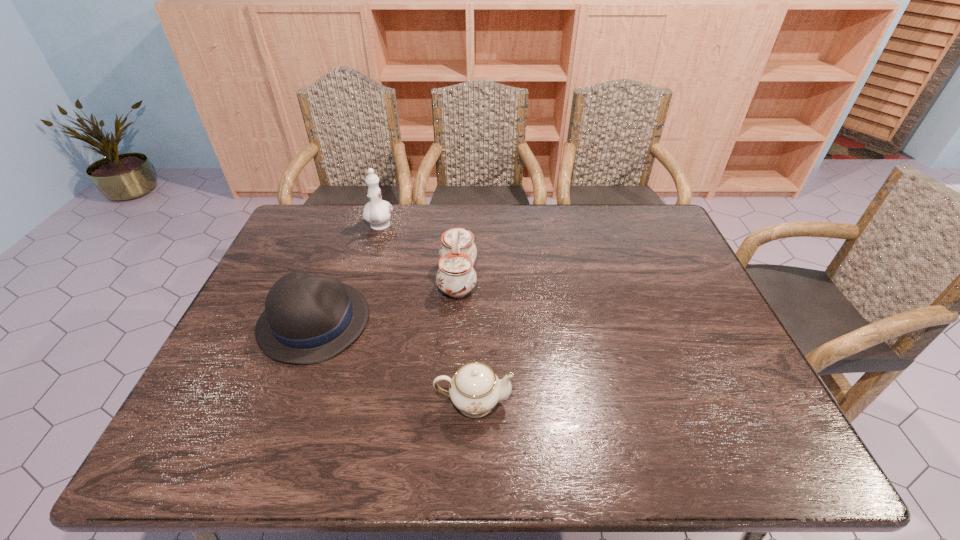
The width and height of the screenshot is (960, 540). I want to click on the tallest object, so click(377, 212).

Locate an element on the screen. the tallest chinaware is located at coordinates (377, 212).

Locate an element on the screen. Image resolution: width=960 pixels, height=540 pixels. the second nearest chinaware is located at coordinates (456, 277).

Locate an element on the screen. This screenshot has height=540, width=960. bowler hat is located at coordinates (308, 319).

The width and height of the screenshot is (960, 540). In order to click on the nearest chinaware in this screenshot , I will do `click(475, 389)`.

Locate an element on the screen. This screenshot has height=540, width=960. the shortest object is located at coordinates (475, 389).

You are a GUI agent. You are given a task and a screenshot of the screen. Output one action in this format:
    pyautogui.click(x=<x>, y=<y>)
    Task: Click on the free space located 0.270m at the spout of the tallest object
    The width and height of the screenshot is (960, 540).
    Given the screenshot: What is the action you would take?
    pyautogui.click(x=359, y=296)

The width and height of the screenshot is (960, 540). I want to click on free space located 0.240m by the handle of the second tallest chinaware, so click(x=558, y=279).

You are a GUI agent. You are given a task and a screenshot of the screen. Output one action in this format:
    pyautogui.click(x=<x>, y=<y>)
    Task: Click on the vacant region located on the front-facing side of the third tallest object
    The width and height of the screenshot is (960, 540).
    Given the screenshot: What is the action you would take?
    pyautogui.click(x=518, y=322)

Locate an element on the screen. The image size is (960, 540). vacant space located 0.300m at the spout of the nearest chinaware is located at coordinates (644, 402).